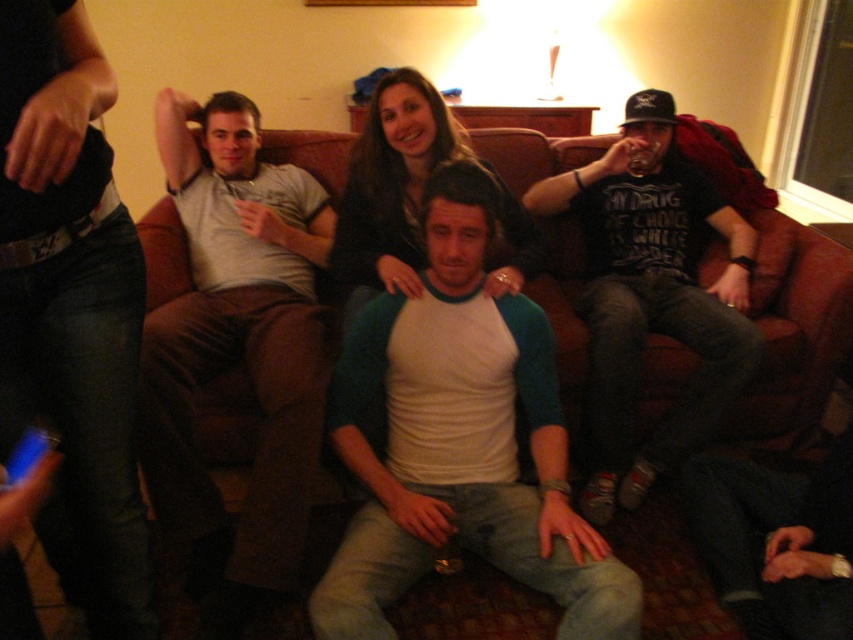
You are a photographer trying to capture a candid shot of the matte gray pants at center and the gray cotton shirt at left. Since you want to ensure both are in focus, you need to know their heights. Which one is shorter?

The matte gray pants at center is shorter than the gray cotton shirt at left, so the pants would be easier to focus on if they are shorter, but both should be in focus as they are part of the same scene.

You are standing in the living room and want to hand a drink to the person wearing the matte gray pants at center and the gray cotton shirt at left. Which one can you reach first without moving your position?

The matte gray pants at center is closer to the viewer than the gray cotton shirt at left, so you can reach the person wearing the matte gray pants at center first.